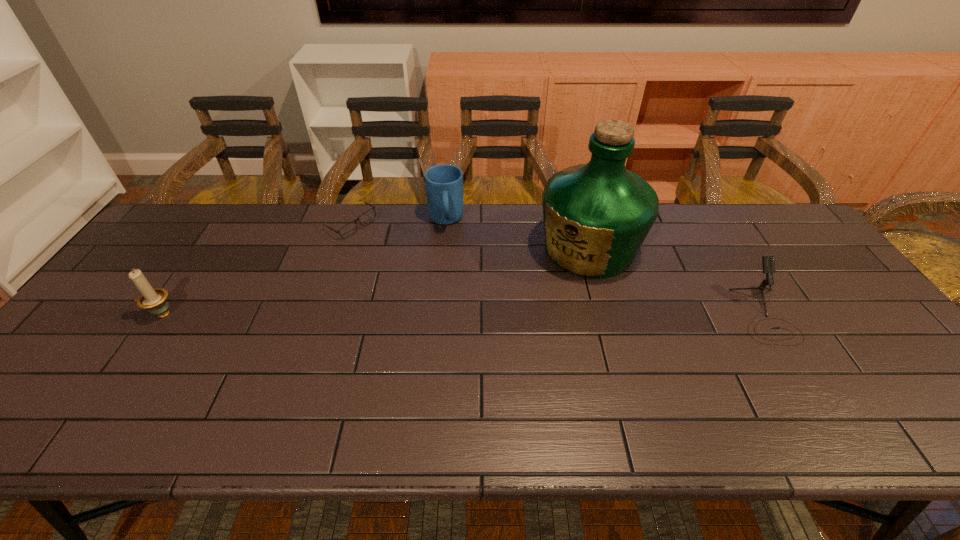
Locate an element on the screen. Image resolution: width=960 pixels, height=540 pixels. empty space between the candle_holder and the rightmost object is located at coordinates (463, 314).

The image size is (960, 540). In order to click on free space between the fourth tallest object and the leftmost object in this screenshot , I will do `click(463, 314)`.

At what (x,y) coordinates should I click in order to perform the action: click on vacant space that is in between the shortest object and the fourth tallest object. Please return your answer as a coordinate pair (x, y). This screenshot has height=540, width=960. Looking at the image, I should click on (558, 269).

At what (x,y) coordinates should I click in order to perform the action: click on free spot between the mug and the candle_holder. Please return your answer as a coordinate pair (x, y). This screenshot has height=540, width=960. Looking at the image, I should click on (303, 267).

Find the location of a particular element. This screenshot has height=540, width=960. unoccupied area between the microphone and the liquor is located at coordinates (676, 282).

Where is `vacant area between the third object from right to left and the tallest object`? vacant area between the third object from right to left and the tallest object is located at coordinates (517, 235).

You are a GUI agent. You are given a task and a screenshot of the screen. Output one action in this format:
    pyautogui.click(x=<x>, y=<y>)
    Task: Click on the free space between the microphone and the fourth object from right to left
    Image resolution: width=960 pixels, height=540 pixels.
    Given the screenshot: What is the action you would take?
    pyautogui.click(x=558, y=269)

Locate an element on the screen. blank region between the shortest object and the liquor is located at coordinates (469, 237).

Where is `the second closest object to the microphone`? This screenshot has width=960, height=540. the second closest object to the microphone is located at coordinates (444, 183).

Where is `object that is the second nearest to the rightmost object`? This screenshot has width=960, height=540. object that is the second nearest to the rightmost object is located at coordinates (444, 183).